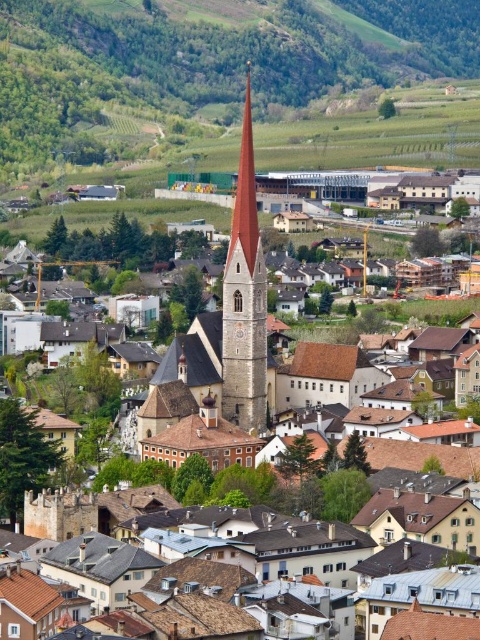
Question: Among these objects, which one is farthest from the camera?

Choices:
 (A) smooth stone spire at center
 (B) green grassy hillside at upper center
 (C) smooth stone church steeple at center

Answer: (B)

Question: Based on their relative distances, which object is nearer to the smooth stone church steeple at center?

Choices:
 (A) green grassy hillside at upper center
 (B) smooth stone spire at center

Answer: (B)

Question: Can you confirm if green grassy hillside at upper center is bigger than smooth stone church steeple at center?

Choices:
 (A) no
 (B) yes

Answer: (B)

Question: Is green grassy hillside at upper center in front of smooth stone church steeple at center?

Choices:
 (A) yes
 (B) no

Answer: (B)

Question: Estimate the real-world distances between objects in this image. Which object is farther from the green grassy hillside at upper center?

Choices:
 (A) smooth stone spire at center
 (B) smooth stone church steeple at center

Answer: (B)

Question: Can you confirm if smooth stone church steeple at center is thinner than smooth stone spire at center?

Choices:
 (A) yes
 (B) no

Answer: (B)